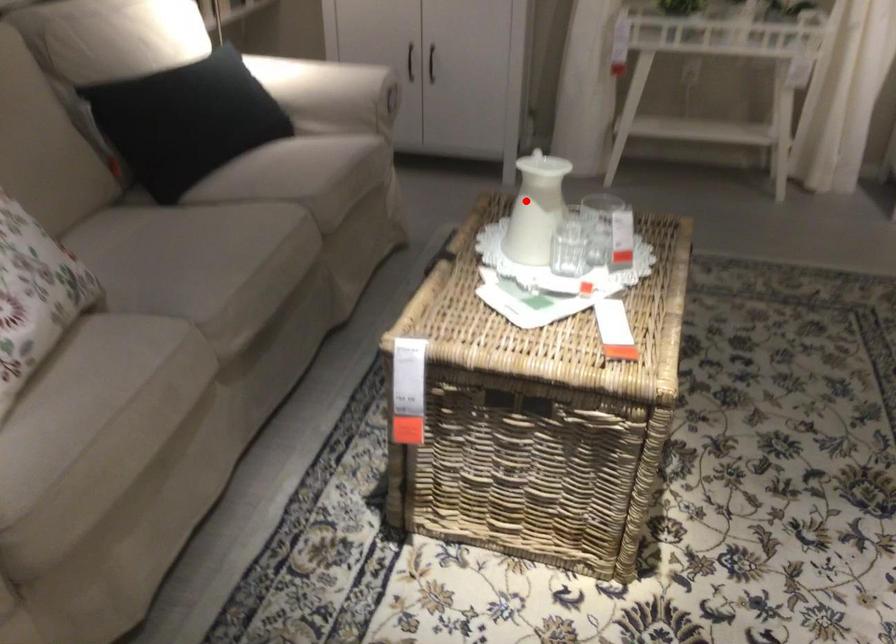
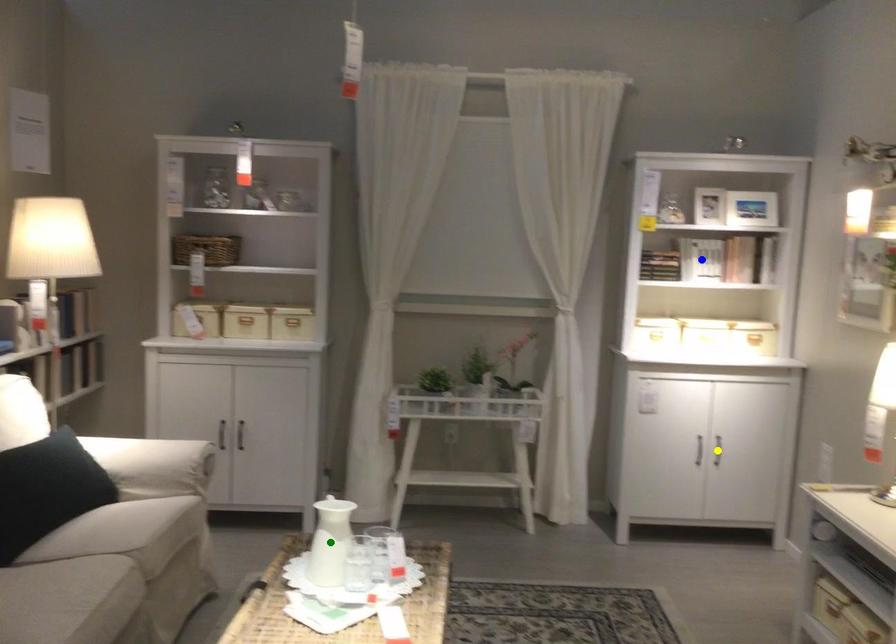
Question: I am providing you with two images of the same scene from different viewpoints. A red point is marked on the first image. You are given multiple points on the second image. Which mark in image 2 goes with the point in image 1?

Choices:
 (A) blue point
 (B) yellow point
 (C) green point

Answer: (C)